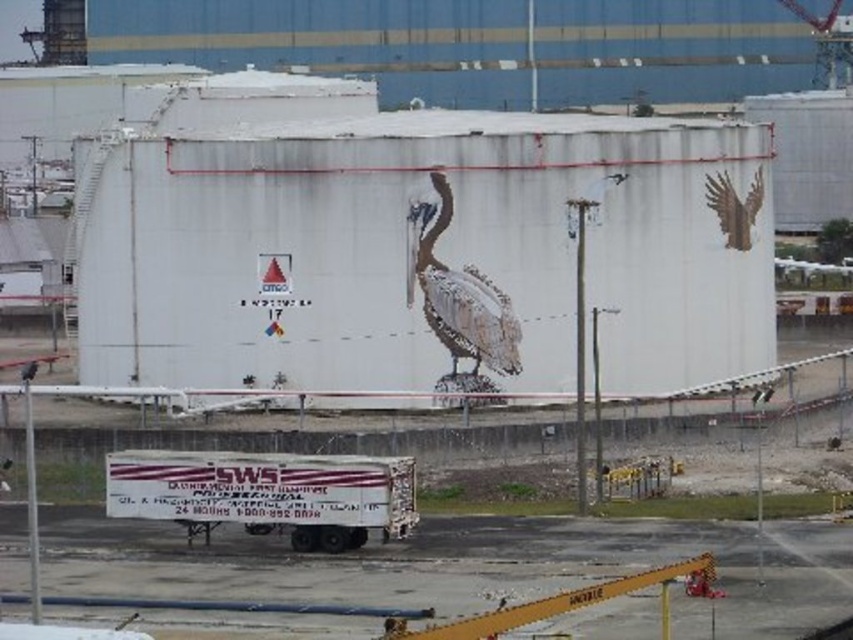
Question: Estimate the real-world distances between objects in this image. Which object is closer to the brown textured pelican at center?

Choices:
 (A) brown matte wings at upper right
 (B) white matte trailer truck at center

Answer: (A)

Question: Is white matte trailer truck at center wider than brown textured pelican at center?

Choices:
 (A) no
 (B) yes

Answer: (B)

Question: Does white matte trailer truck at center have a lesser width compared to brown matte wings at upper right?

Choices:
 (A) no
 (B) yes

Answer: (A)

Question: Which object is the closest to the white matte trailer truck at center?

Choices:
 (A) brown matte wings at upper right
 (B) brown textured pelican at center

Answer: (B)

Question: Which point is farther to the camera?

Choices:
 (A) brown matte wings at upper right
 (B) brown textured pelican at center

Answer: (A)

Question: Can you confirm if white matte trailer truck at center is smaller than brown textured pelican at center?

Choices:
 (A) yes
 (B) no

Answer: (B)